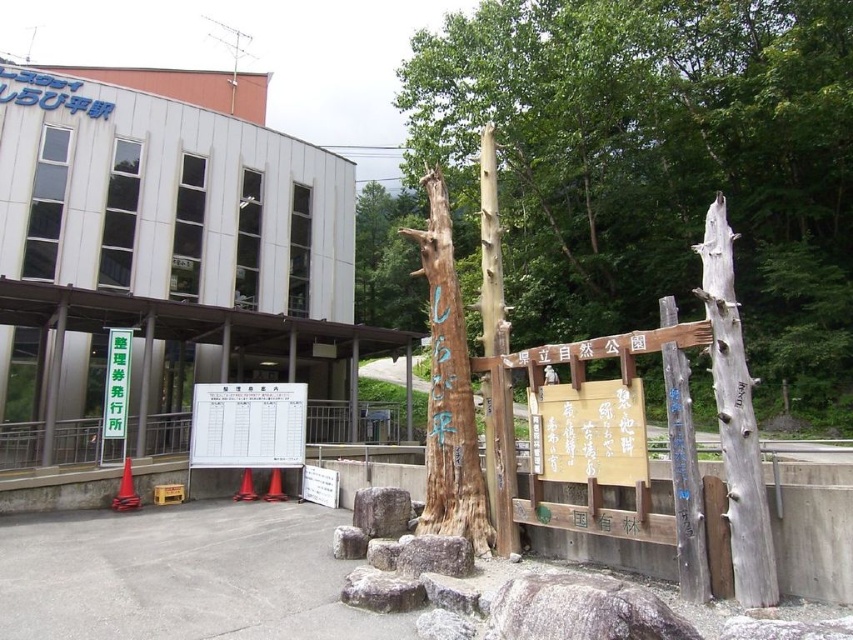
Question: Among these points, which one is nearest to the camera?

Choices:
 (A) (488, 140)
 (B) (450, 524)
 (C) (601, 218)
 (D) (709, 304)

Answer: (D)

Question: Which of the following is the closest to the observer?

Choices:
 (A) wooden signpost at center
 (B) natural wood signpost at center

Answer: (B)

Question: Is natural wood signpost at center below gray weathered wood totem pole at right?

Choices:
 (A) no
 (B) yes

Answer: (A)

Question: In this image, where is wooden signpost at center located relative to gray weathered wood totem pole at right?

Choices:
 (A) right
 (B) left

Answer: (A)

Question: Which object is the farthest from the natural wood signpost at center?

Choices:
 (A) white plastic signboard at center
 (B) gray weathered wood totem pole at right
 (C) wooden signpost at center
 (D) wooden totem pole at center

Answer: (C)

Question: Can you confirm if natural wood signpost at center is bigger than wooden totem pole at center?

Choices:
 (A) no
 (B) yes

Answer: (B)